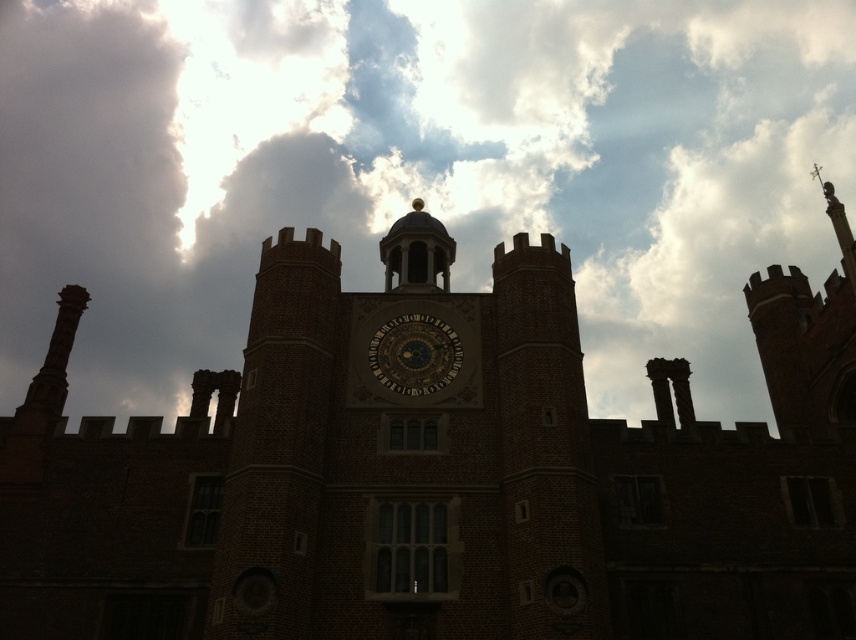
Can you confirm if white fluffy cloud at upper center is wider than gold metallic clock at center?

Correct, the width of white fluffy cloud at upper center exceeds that of gold metallic clock at center.

Which is in front, point (366, 268) or point (441, 369)?

Point (441, 369) is more forward.

You are a GUI agent. You are given a task and a screenshot of the screen. Output one action in this format:
    pyautogui.click(x=<x>, y=<y>)
    Task: Click on the white fluffy cloud at upper center
    The height and width of the screenshot is (640, 856).
    Given the screenshot: What is the action you would take?
    pyautogui.click(x=412, y=168)

Looking at this image, which is below, white fluffy cloud at upper center or brick clock tower at center?

Positioned lower is brick clock tower at center.

Based on the photo, does white fluffy cloud at upper center have a greater width compared to brick clock tower at center?

Correct, the width of white fluffy cloud at upper center exceeds that of brick clock tower at center.

At what (x,y) coordinates should I click in order to perform the action: click on white fluffy cloud at upper center. Please return your answer as a coordinate pair (x, y). Looking at the image, I should click on (412, 168).

Is point (450, 608) farther from camera compared to point (449, 374)?

That is False.

Is brick clock tower at center bigger than gold metallic clock at center?

Indeed, brick clock tower at center has a larger size compared to gold metallic clock at center.

Image resolution: width=856 pixels, height=640 pixels. Describe the element at coordinates (409, 456) in the screenshot. I see `brick clock tower at center` at that location.

Locate an element on the screen. brick clock tower at center is located at coordinates (409, 456).